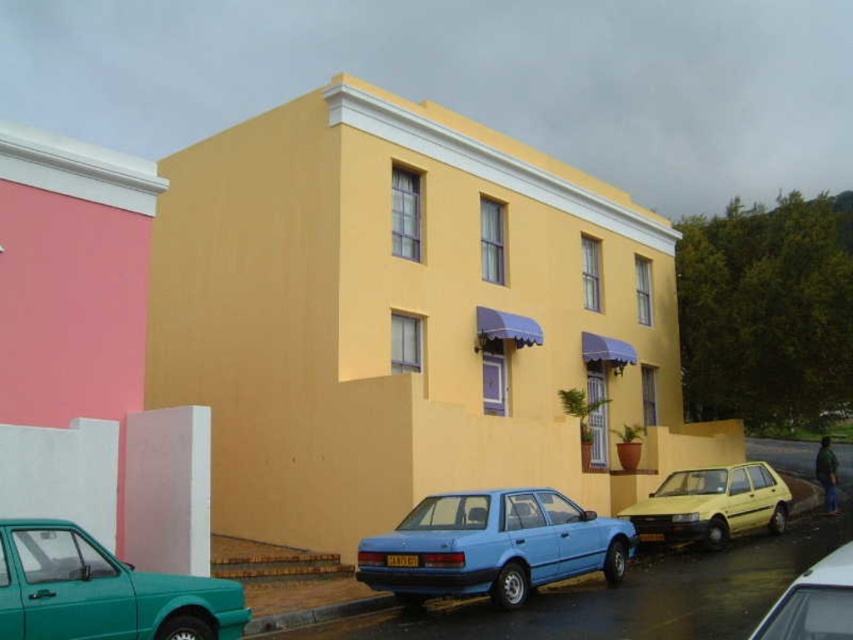
Between matte blue sedan at center and metallic silver car at lower right, which one is positioned higher?

Positioned higher is metallic silver car at lower right.

Is matte blue sedan at center taller than metallic silver car at lower right?

Correct, matte blue sedan at center is much taller as metallic silver car at lower right.

Image resolution: width=853 pixels, height=640 pixels. What are the coordinates of `matte blue sedan at center` in the screenshot? It's located at (x=492, y=547).

Consider the image. Is teal glossy hatchback at lower left further to camera compared to yellow matte car at lower right?

No, it is not.

What do you see at coordinates (102, 592) in the screenshot? I see `teal glossy hatchback at lower left` at bounding box center [102, 592].

The height and width of the screenshot is (640, 853). I want to click on teal glossy hatchback at lower left, so click(102, 592).

Where is `matte blue sedan at center`? This screenshot has width=853, height=640. matte blue sedan at center is located at coordinates (492, 547).

Can you confirm if matte blue sedan at center is positioned above yellow matte car at lower right?

Correct, matte blue sedan at center is located above yellow matte car at lower right.

Which is behind, point (590, 516) or point (666, 493)?

Positioned behind is point (666, 493).

This screenshot has width=853, height=640. Find the location of `matte blue sedan at center`. matte blue sedan at center is located at coordinates (492, 547).